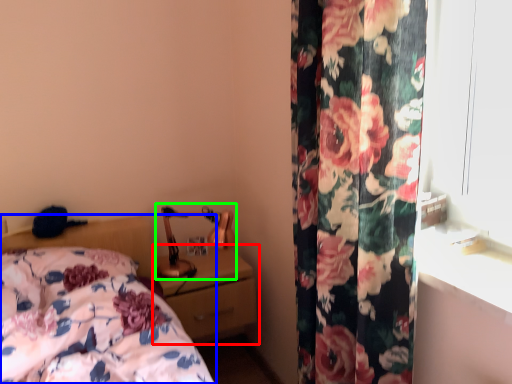
Question: Estimate the real-world distances between objects in this image. Which object is farther from nightstand (highlighted by a red box), bed (highlighted by a blue box) or table lamp (highlighted by a green box)?

Choices:
 (A) bed
 (B) table lamp

Answer: (A)